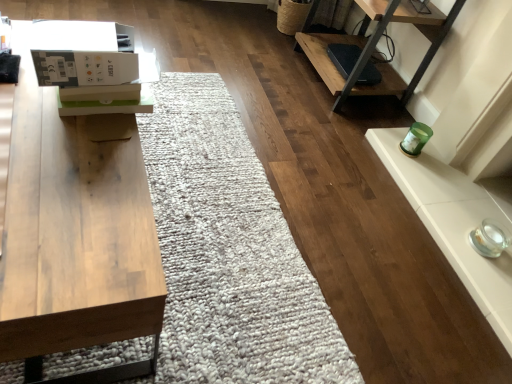
This screenshot has height=384, width=512. I want to click on vacant space situated above white cardboard box at upper left (from a real-world perspective), so click(81, 34).